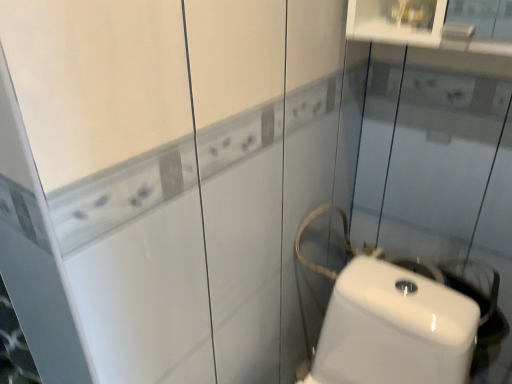
Identify the location of white glossy toilet at lower right. The width and height of the screenshot is (512, 384). (394, 328).

The width and height of the screenshot is (512, 384). Describe the element at coordinates (394, 328) in the screenshot. I see `white glossy toilet at lower right` at that location.

Locate an element on the screen. This screenshot has height=384, width=512. white glossy toilet at lower right is located at coordinates (394, 328).